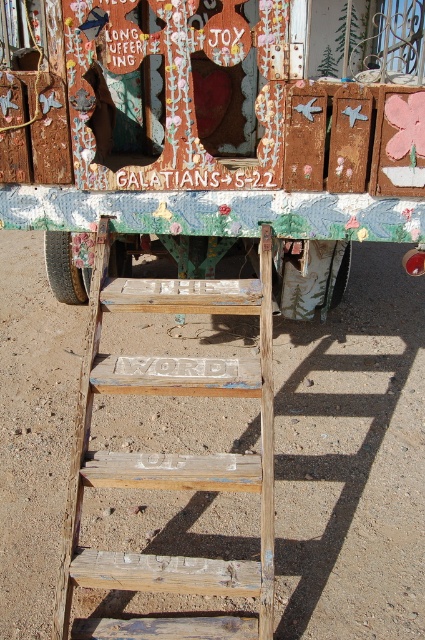
You are standing in front of the structure described in the scene. There is a point marked at coordinates (x=221, y=134). What object is located at this point?

The point at coordinates (x=221, y=134) corresponds to the rusty metal food truck at center.

You are an artist planning to paint the weathered wood ladder at center and the white painted wood at center. Since you have limited paint, which object should you prioritize to paint first based on their size?

The weathered wood ladder at center is much taller than the white painted wood at center, so you should prioritize painting the weathered wood ladder at center first because it requires more paint due to its larger size.

You are an artist standing in front of the structure and want to paint two points on it. The first point is at coordinate point [184,104] and the second is at point [189,572]. Which point is closer to you?

Point [184,104] is closer to you because it is further to the viewer than point [189,572].